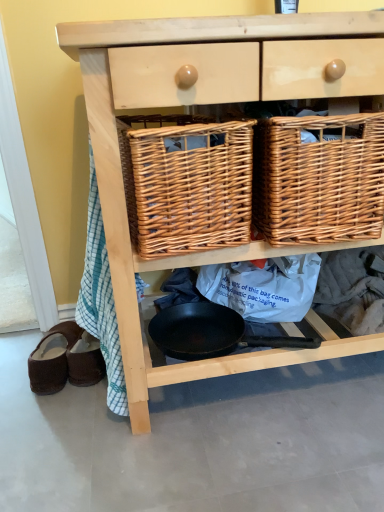
Question: Does woven brown picnic basket at center, the 1th picnic basket from the left, appear on the right side of brown suede sandals at lower left, which is the 1th footwear in right-to-left order?

Choices:
 (A) no
 (B) yes

Answer: (B)

Question: Could you tell me if woven brown picnic basket at center, the second picnic basket positioned from the right, is turned towards brown suede sandals at lower left, which is the 1th footwear in right-to-left order?

Choices:
 (A) yes
 (B) no

Answer: (B)

Question: From the image's perspective, is woven brown picnic basket at center, the second picnic basket positioned from the right, over brown suede sandals at lower left, which is the 1th footwear in right-to-left order?

Choices:
 (A) no
 (B) yes

Answer: (B)

Question: Is woven brown picnic basket at center, the 1th picnic basket from the left, outside brown suede sandals at lower left, which is the 1th footwear in right-to-left order?

Choices:
 (A) yes
 (B) no

Answer: (A)

Question: Is woven brown picnic basket at center, the second picnic basket positioned from the right, smaller than brown suede sandals at lower left, which appears as the 2th footwear when viewed from the left?

Choices:
 (A) yes
 (B) no

Answer: (B)

Question: Is woven brown picnic basket at center, the 1th picnic basket from the left, far away from brown suede sandals at lower left, which appears as the 2th footwear when viewed from the left?

Choices:
 (A) yes
 (B) no

Answer: (B)

Question: Considering the relative sizes of natural wood chest of drawers at center and black non-stick frying pan at center in the image provided, is natural wood chest of drawers at center bigger than black non-stick frying pan at center?

Choices:
 (A) no
 (B) yes

Answer: (B)

Question: From the image's perspective, does natural wood chest of drawers at center appear lower than black non-stick frying pan at center?

Choices:
 (A) yes
 (B) no

Answer: (B)

Question: Does natural wood chest of drawers at center come behind black non-stick frying pan at center?

Choices:
 (A) yes
 (B) no

Answer: (B)

Question: Does natural wood chest of drawers at center have a greater width compared to black non-stick frying pan at center?

Choices:
 (A) no
 (B) yes

Answer: (B)

Question: Does natural wood chest of drawers at center have a lesser height compared to black non-stick frying pan at center?

Choices:
 (A) yes
 (B) no

Answer: (B)

Question: From a real-world perspective, does natural wood chest of drawers at center stand above black non-stick frying pan at center?

Choices:
 (A) no
 (B) yes

Answer: (B)

Question: Can you confirm if woven brown picnic basket at center, which is counted as the second picnic basket, starting from the left, is wider than woven brown picnic basket at center, the second picnic basket positioned from the right?

Choices:
 (A) no
 (B) yes

Answer: (B)